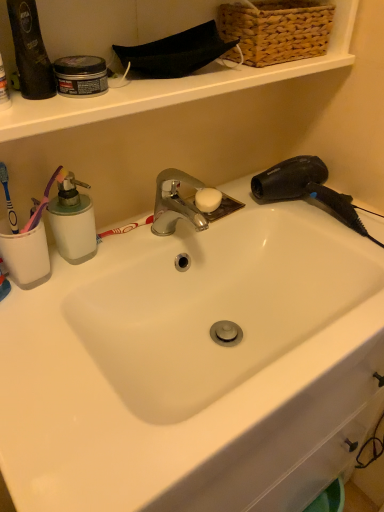
Locate an element on the screen. The width and height of the screenshot is (384, 512). vacant space in front of white plastic soap dispenser at left is located at coordinates (52, 325).